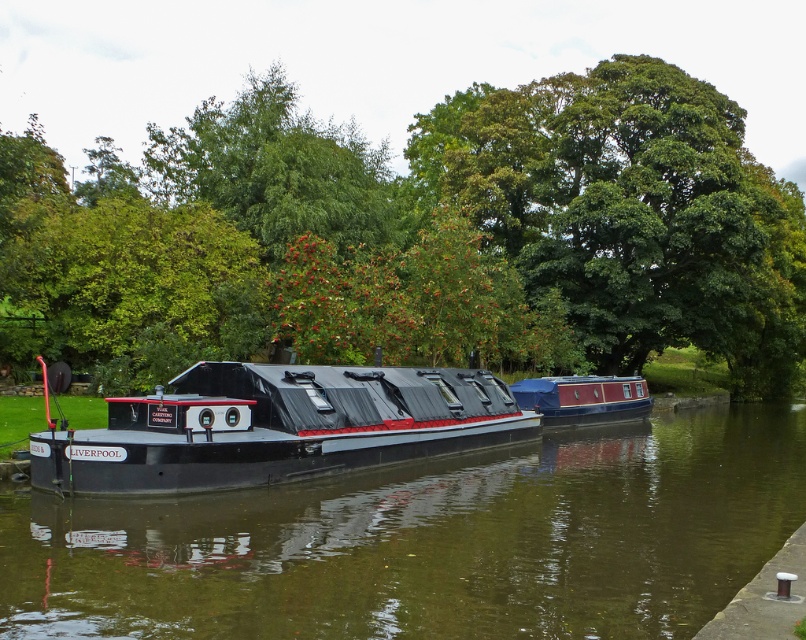
Question: Which of these objects is positioned closest to the green leafy tree at center?

Choices:
 (A) black glossy boat at center
 (B) black matte barge at center
 (C) blue painted wooden boat at center

Answer: (C)

Question: Does black glossy boat at center come in front of blue painted wooden boat at center?

Choices:
 (A) yes
 (B) no

Answer: (A)

Question: Which point is farther from the camera taking this photo?

Choices:
 (A) (305, 552)
 (B) (377, 376)
 (C) (107, 173)
 (D) (555, 410)

Answer: (C)

Question: Does black glossy boat at center have a lesser width compared to black matte barge at center?

Choices:
 (A) no
 (B) yes

Answer: (A)

Question: Which point is closer to the camera?

Choices:
 (A) black glossy boat at center
 (B) green leafy tree at center
 (C) black matte barge at center
 (D) blue painted wooden boat at center

Answer: (A)

Question: Does green leafy tree at center lie behind blue painted wooden boat at center?

Choices:
 (A) yes
 (B) no

Answer: (B)